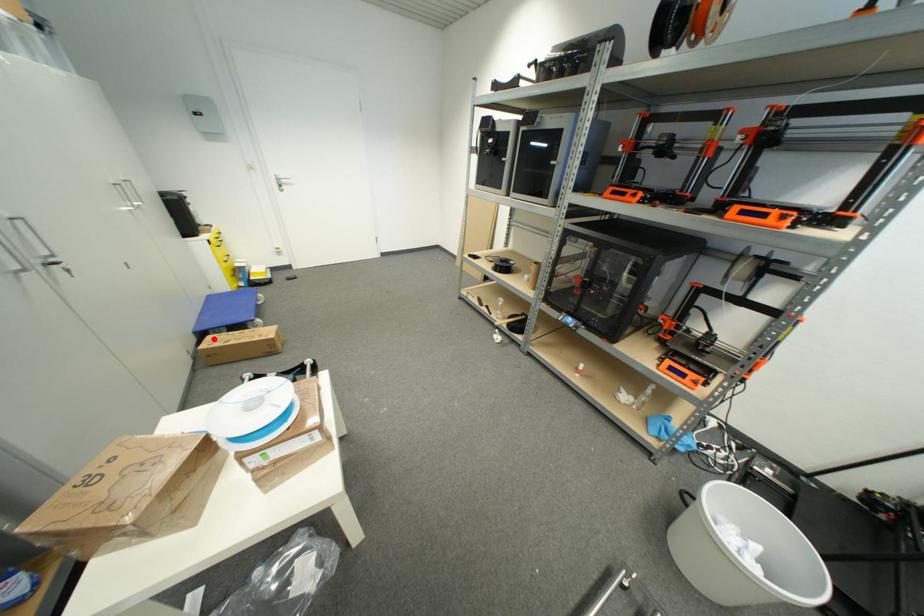
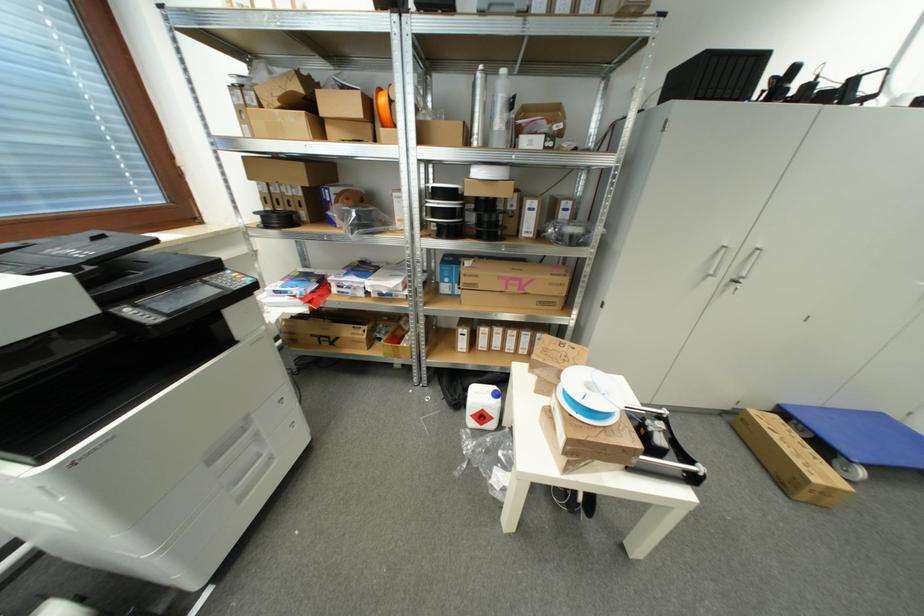
Question: I am providing you with two images of the same scene from different viewpoints. In image1, a red point is highlighted. Considering the same 3D point in image2, which of the following is correct?

Choices:
 (A) It is closer
 (B) It is farther

Answer: (A)